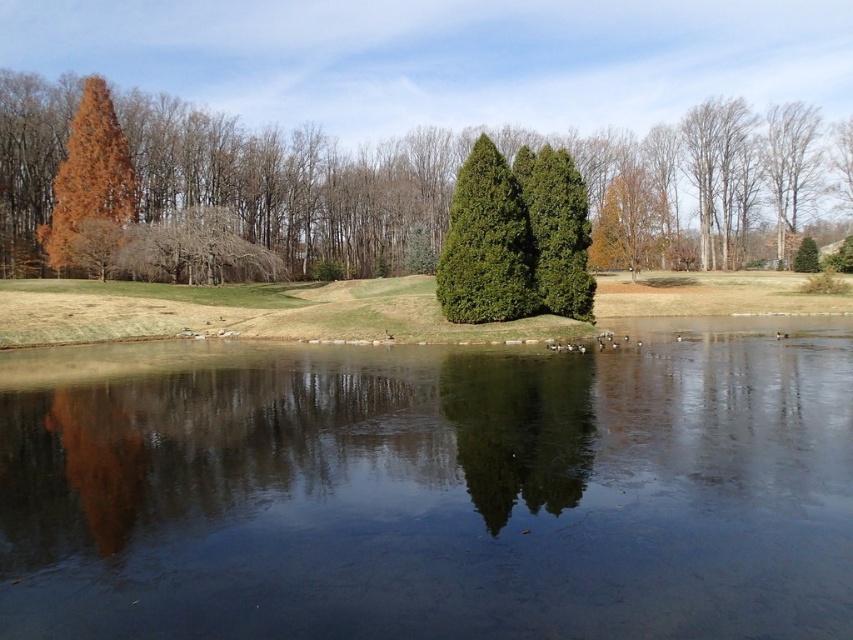
Is orange matte tree at upper left to the right of green grassy golf course at center from the viewer's perspective?

No, orange matte tree at upper left is not to the right of green grassy golf course at center.

Is orange matte tree at upper left shorter than green grassy golf course at center?

Incorrect, orange matte tree at upper left's height does not fall short of green grassy golf course at center's.

Where is `orange matte tree at upper left`? This screenshot has width=853, height=640. orange matte tree at upper left is located at coordinates (294, 184).

Where is `orange matte tree at upper left`? orange matte tree at upper left is located at coordinates (294, 184).

Is green grassy golf course at center to the right of orange matte tree at lower left from the viewer's perspective?

Yes, green grassy golf course at center is to the right of orange matte tree at lower left.

The width and height of the screenshot is (853, 640). Identify the location of green grassy golf course at center. (242, 310).

Does point (645, 304) come closer to viewer compared to point (126, 467)?

No, it is behind (126, 467).

What are the coordinates of `green grassy golf course at center` in the screenshot? It's located at (242, 310).

Who is shorter, smooth dark water at center or green textured tree at center?

smooth dark water at center

Which is above, smooth dark water at center or green textured tree at center?

green textured tree at center

You are a GUI agent. You are given a task and a screenshot of the screen. Output one action in this format:
    pyautogui.click(x=<x>, y=<y>)
    Task: Click on the smooth dark water at center
    The image size is (853, 640).
    Given the screenshot: What is the action you would take?
    pyautogui.click(x=430, y=490)